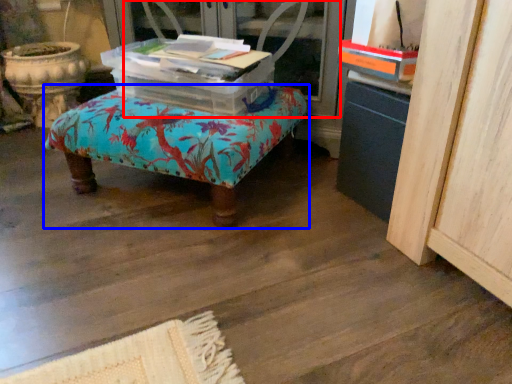
Question: Which point is closer to the camera, screen door (highlighted by a red box) or furniture (highlighted by a blue box)?

Choices:
 (A) screen door
 (B) furniture

Answer: (B)